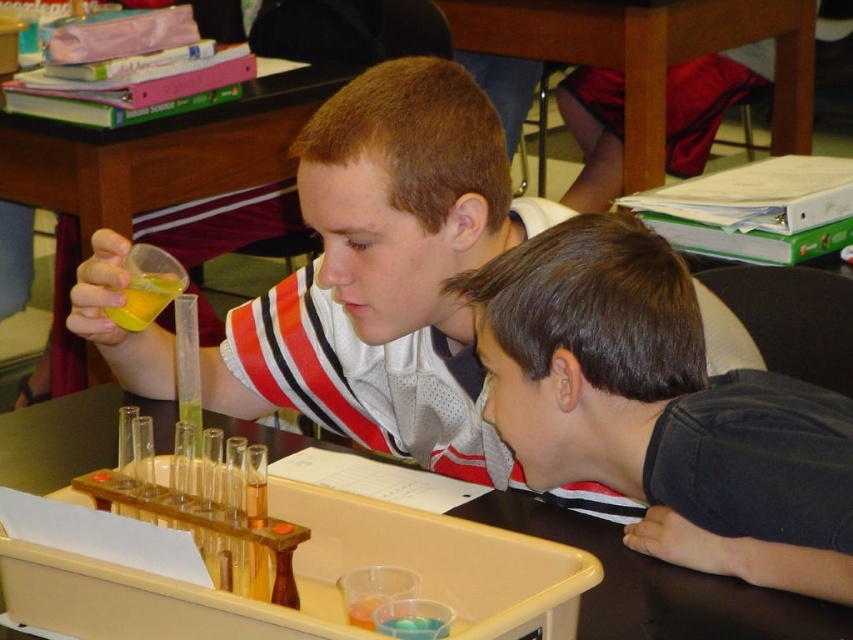
You are a student in the classroom and need to determine which object is smaller between the dark gray shirt at lower right and the translucent plastic test tube at upper center. Can you identify the smaller one?

The dark gray shirt at lower right has a smaller size compared to the translucent plastic test tube at upper center, so the dark gray shirt at lower right is the smaller one.

You are standing in a classroom and see two people at a desk. One holds a transparent plastic cup with yellow liquid, and the other is looking at the translucent plastic test tube at upper center. Can you determine if the test tube is positioned to the left or right of the cup?

The translucent plastic test tube at upper center is located at point (221,221), so it is positioned to the right of the cup.

You are a student in the classroom and you need to reach both the translucent plastic test tube at upper center and the yellow translucent cup at upper left. Which object is located higher up?

The translucent plastic test tube at upper center is located higher up than the yellow translucent cup at upper left.